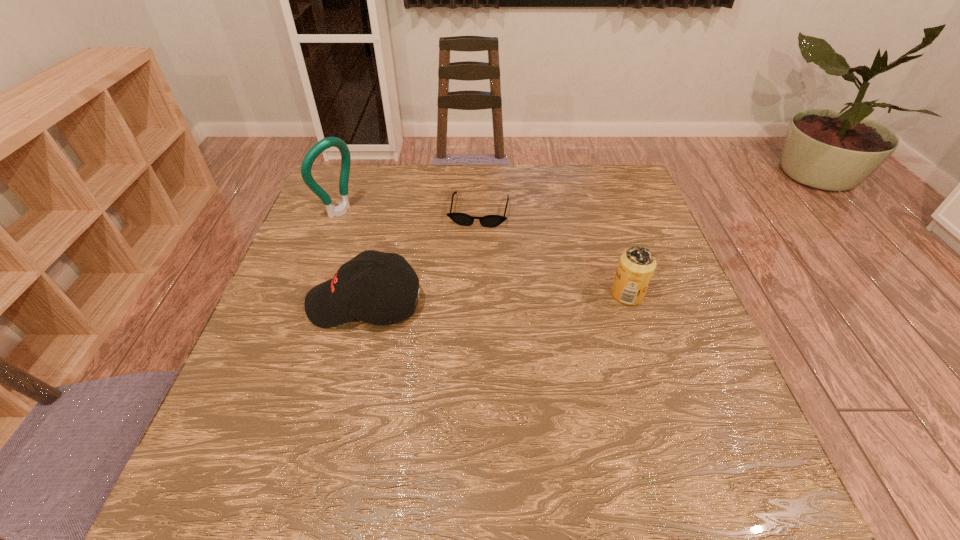
Image resolution: width=960 pixels, height=540 pixels. I want to click on blank area located 0.270m at the jaws of the tallest object, so click(x=420, y=261).

You are a GUI agent. You are given a task and a screenshot of the screen. Output one action in this format:
    pyautogui.click(x=<x>, y=<y>)
    Task: Click on the free space located on the front-facing side of the shortest object
    Image resolution: width=960 pixels, height=540 pixels.
    Given the screenshot: What is the action you would take?
    pyautogui.click(x=461, y=305)

Locate an element on the screen. The width and height of the screenshot is (960, 540). vacant space located 0.350m on the front-facing side of the shortest object is located at coordinates pos(456,329).

You are a GUI agent. You are given a task and a screenshot of the screen. Output one action in this format:
    pyautogui.click(x=<x>, y=<y>)
    Task: Click on the vacant area located 0.160m on the front-facing side of the shortest object
    The height and width of the screenshot is (540, 960).
    Given the screenshot: What is the action you would take?
    pyautogui.click(x=468, y=269)

At what (x,y) coordinates should I click in order to perform the action: click on bottle opener located in the far edge section of the desktop. Please return your answer as a coordinate pair (x, y). This screenshot has width=960, height=540. Looking at the image, I should click on (341, 209).

Find the location of a particular element. sunglasses that is at the far edge is located at coordinates (490, 221).

Locate an element on the screen. The image size is (960, 540). baseball cap present at the left edge is located at coordinates click(x=348, y=296).

The height and width of the screenshot is (540, 960). I want to click on bottle opener that is positioned at the left edge, so click(x=341, y=209).

This screenshot has width=960, height=540. Find the location of `object positioned at the right edge`. object positioned at the right edge is located at coordinates (636, 267).

Find the location of a particular element. The width and height of the screenshot is (960, 540). object situated at the far left corner is located at coordinates (341, 209).